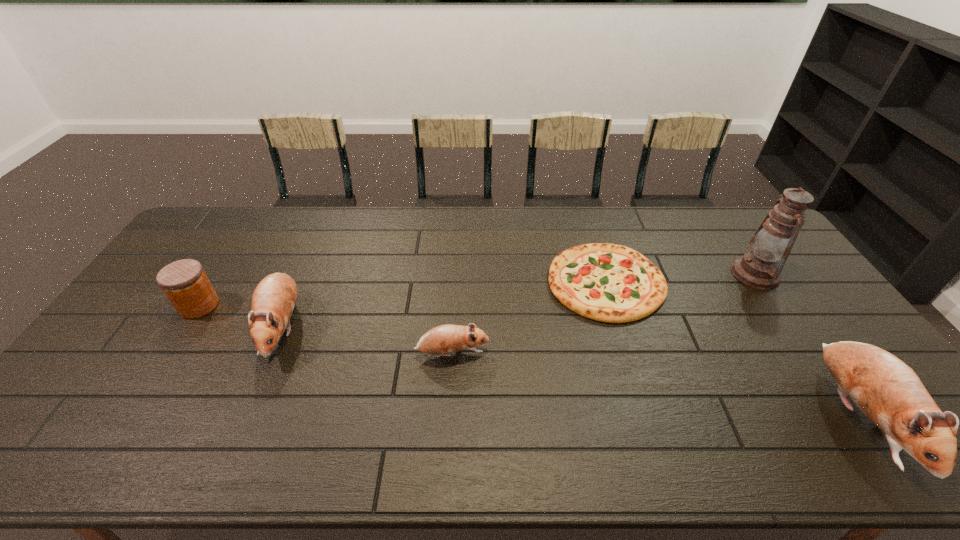
What are the coordinates of `empty space that is in between the rightmost hamster and the leftmost object` in the screenshot? It's located at (529, 361).

This screenshot has width=960, height=540. I want to click on free spot between the fifth tallest object and the rightmost hamster, so click(655, 385).

Where is `empty location between the oil lamp and the rightmost hamster`? Image resolution: width=960 pixels, height=540 pixels. empty location between the oil lamp and the rightmost hamster is located at coordinates (806, 346).

At what (x,y) coordinates should I click in order to perform the action: click on object that is the nearest to the rightmost hamster. Please return your answer as a coordinate pair (x, y). Image resolution: width=960 pixels, height=540 pixels. Looking at the image, I should click on (760, 268).

Identify which object is located as the fifth nearest to the oil lamp. Please provide its 2D coordinates. Your answer should be formatted as a tuple, i.e. [(x, y)], where the tuple contains the x and y coordinates of a point satisfying the conditions above.

[(184, 282)]

The image size is (960, 540). Find the location of `hamster that is the closest to the rightmost hamster`. hamster that is the closest to the rightmost hamster is located at coordinates (448, 338).

You are a GUI agent. You are given a task and a screenshot of the screen. Output one action in this format:
    pyautogui.click(x=<x>, y=<y>)
    Task: Click on the hamster that is the closest to the fourth object from left to right
    Image resolution: width=960 pixels, height=540 pixels.
    Given the screenshot: What is the action you would take?
    pyautogui.click(x=448, y=338)